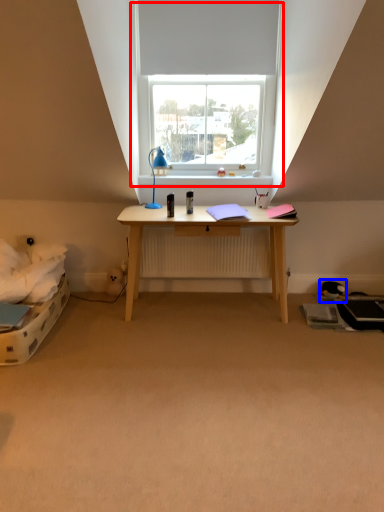
Question: Which of the following is the farthest to the observer, window (highlighted by a red box) or toy (highlighted by a blue box)?

Choices:
 (A) window
 (B) toy

Answer: (B)